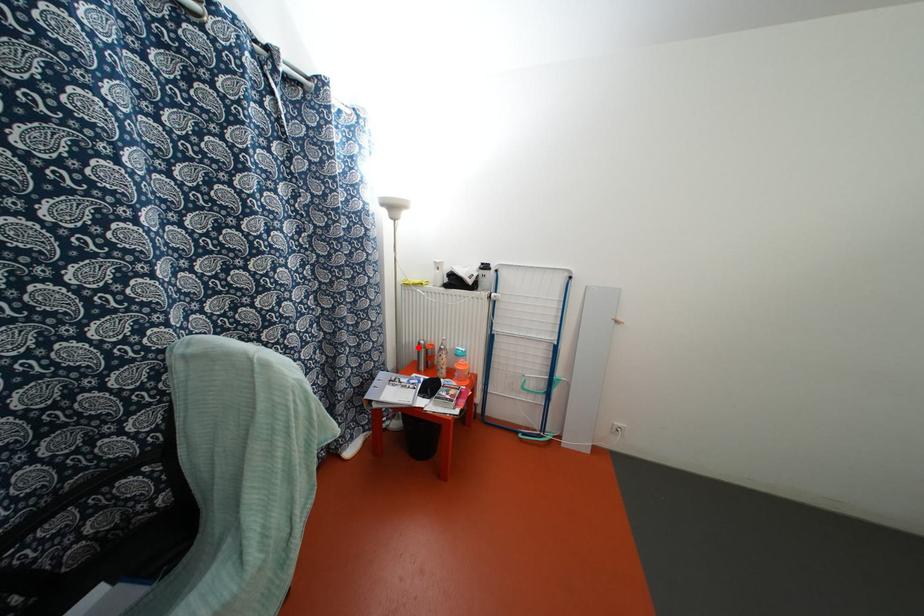
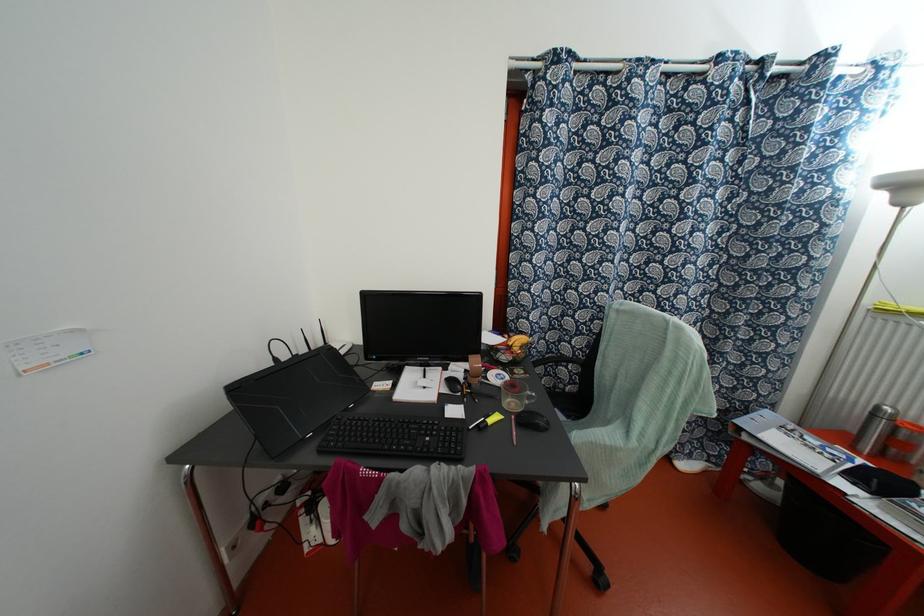
Question: I am providing you with two images of the same scene from different viewpoints. A red point is marked on the first image. At the location where the point appears in image 1, is it still visible in image 2?

Choices:
 (A) Yes
 (B) No

Answer: (A)